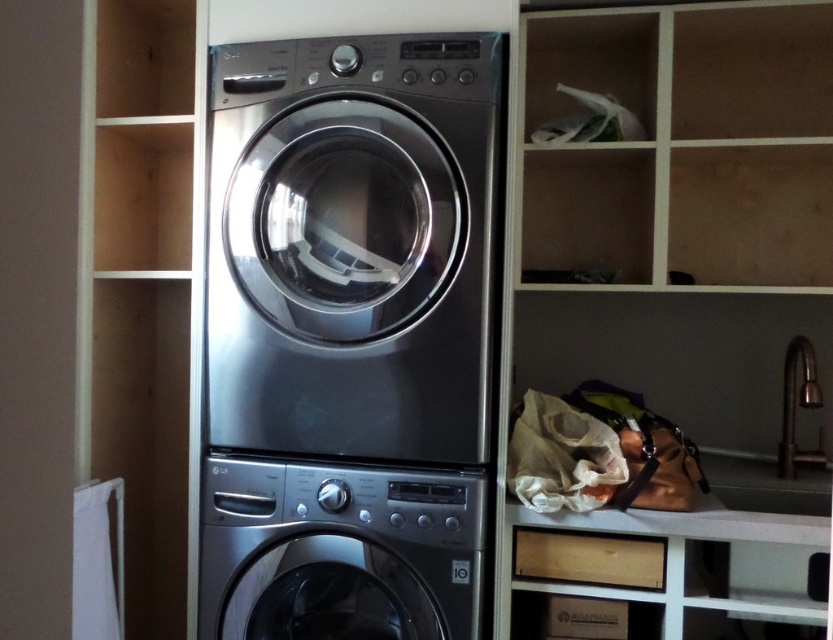
Who is higher up, stainless steel washing machine at center or satin silver washing machine at center?

stainless steel washing machine at center

You are a GUI agent. You are given a task and a screenshot of the screen. Output one action in this format:
    pyautogui.click(x=<x>, y=<y>)
    Task: Click on the stainless steel washing machine at center
    
    Given the screenshot: What is the action you would take?
    pyautogui.click(x=352, y=244)

Does point (298, 301) come farther from viewer compared to point (464, 486)?

Yes, point (298, 301) is behind point (464, 486).

At what (x,y) coordinates should I click in order to perform the action: click on stainless steel washing machine at center. Please return your answer as a coordinate pair (x, y). Looking at the image, I should click on (352, 244).